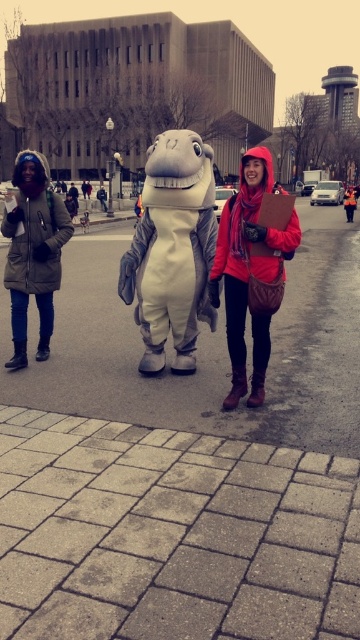
Question: Which point appears closest to the camera in this image?

Choices:
 (A) pos(144,364)
 (B) pos(50,248)

Answer: (A)

Question: Which object is closer to the camera taking this photo?

Choices:
 (A) matte red scarf at center
 (B) brick pavement at center

Answer: (B)

Question: Among these points, which one is nearest to the camera?

Choices:
 (A) (270, 305)
 (B) (23, 282)
 (C) (168, 314)
 (D) (168, 388)

Answer: (A)

Question: Is matte red scarf at center above matte green coat at left?

Choices:
 (A) no
 (B) yes

Answer: (B)

Question: Is brick pavement at center bigger than white plush dinosaur at center?

Choices:
 (A) no
 (B) yes

Answer: (B)

Question: Can you confirm if brick pavement at center is positioned above white plush dinosaur at center?

Choices:
 (A) yes
 (B) no

Answer: (A)